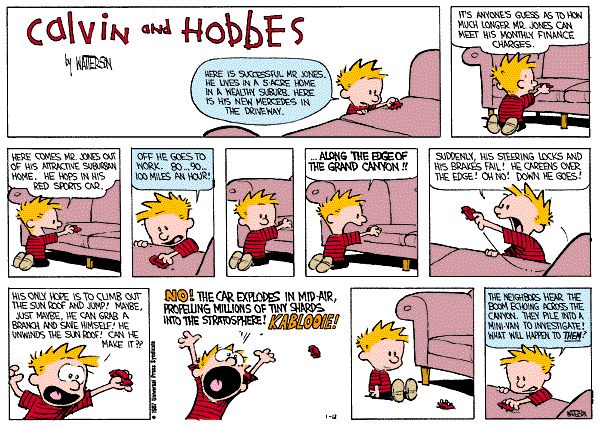
Where is `occurences of pink couch throughout comic strip`? occurences of pink couch throughout comic strip is located at coordinates (551, 406), (452, 352), (483, 265), (393, 234), (284, 239), (196, 263), (100, 237), (410, 117), (565, 94).